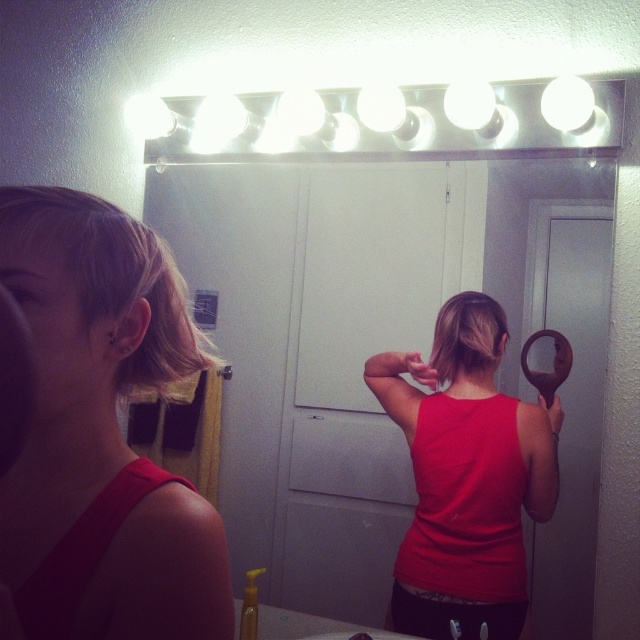
Image resolution: width=640 pixels, height=640 pixels. In order to click on matte plastic mirror at center in this screenshot , I will do `click(339, 340)`.

Between point (348, 556) and point (445, 332), which one is positioned behind?

The point (348, 556) is behind.

Image resolution: width=640 pixels, height=640 pixels. What are the coordinates of `matte plastic mirror at center` in the screenshot? It's located at (339, 340).

Between point (401, 394) and point (452, 368), which one is positioned behind?

The point (401, 394) is more distant.

Can you confirm if matte red tank top at center is taller than blondehair at center?

Correct, matte red tank top at center is much taller as blondehair at center.

I want to click on matte red tank top at center, so click(x=467, y=476).

Which is more to the left, matte plastic mirror at center or blonde hair at left?

From the viewer's perspective, blonde hair at left appears more on the left side.

Can you confirm if matte plastic mirror at center is positioned to the left of blonde hair at left?

No, matte plastic mirror at center is not to the left of blonde hair at left.

Which is behind, point (266, 284) or point (100, 230)?

The point (266, 284) is behind.

Identify the location of matte plastic mirror at center. (339, 340).